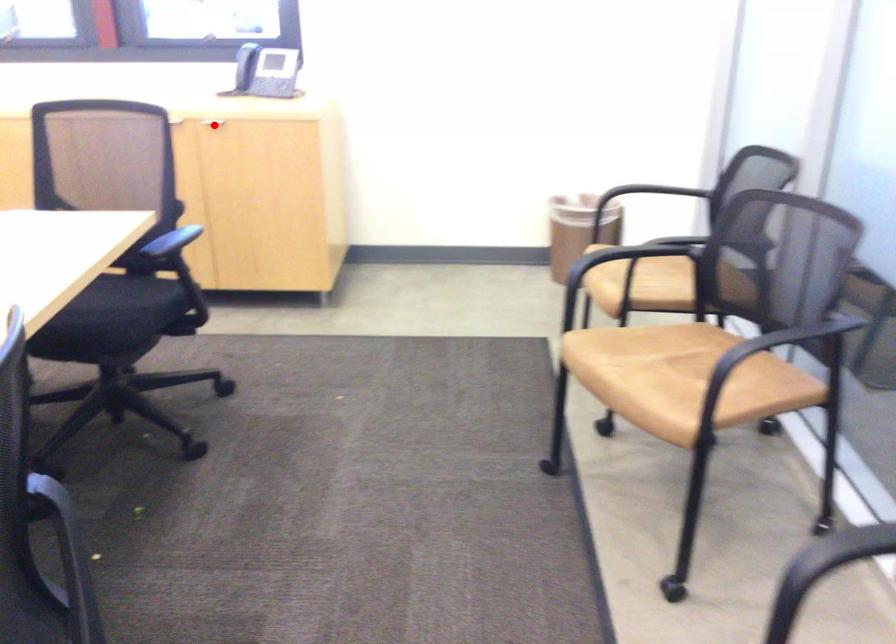
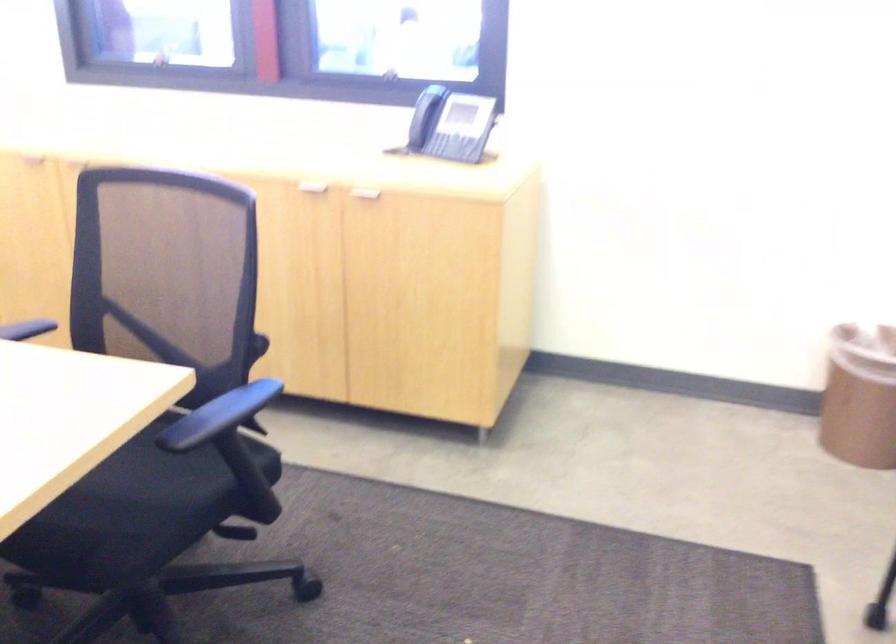
Question: I am providing you with two images of the same scene from different viewpoints. Given a red point in image1, look at the same physical point in image2. Is it:

Choices:
 (A) Closer to the viewpoint
 (B) Farther from the viewpoint

Answer: (A)